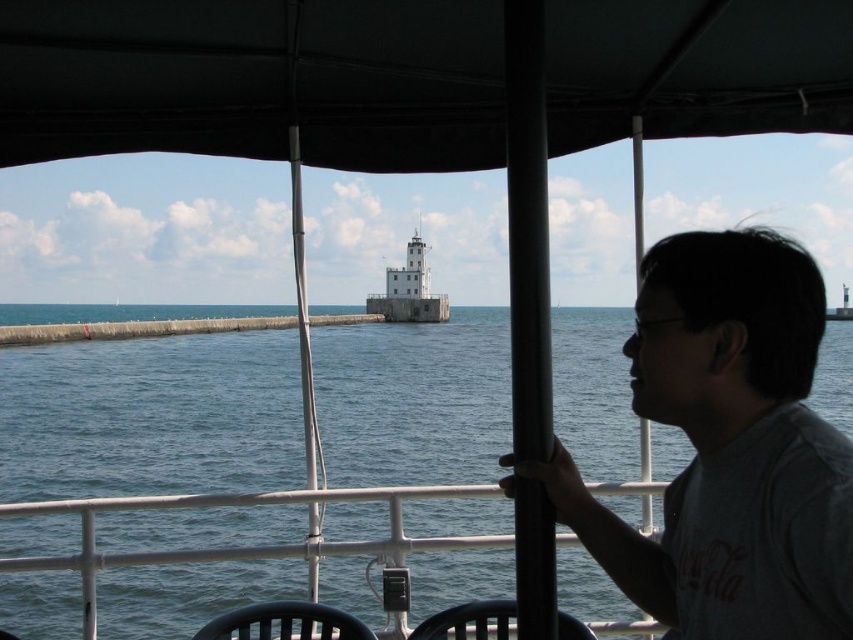
You are a photographer trying to capture the lighthouse in the background. You notice the black fabric canopy at upper center and the gray matte shirt at right might block your view. Which object is taller and could potentially block more of the lighthouse in your photo?

The black fabric canopy at upper center is taller than the gray matte shirt at right, so it could potentially block more of the lighthouse in your photo.

You are a passenger on the ferry and want to know where the black fabric canopy at upper center is located. Can you tell me its exact coordinates?

The black fabric canopy at upper center is located at point (256, 81).